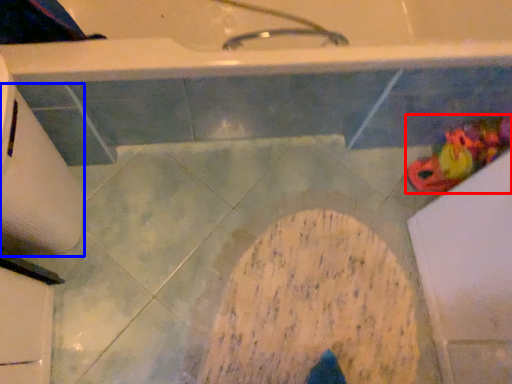
Question: Which object is closer to the camera taking this photo, toy (highlighted by a red box) or toilet paper (highlighted by a blue box)?

Choices:
 (A) toy
 (B) toilet paper

Answer: (B)